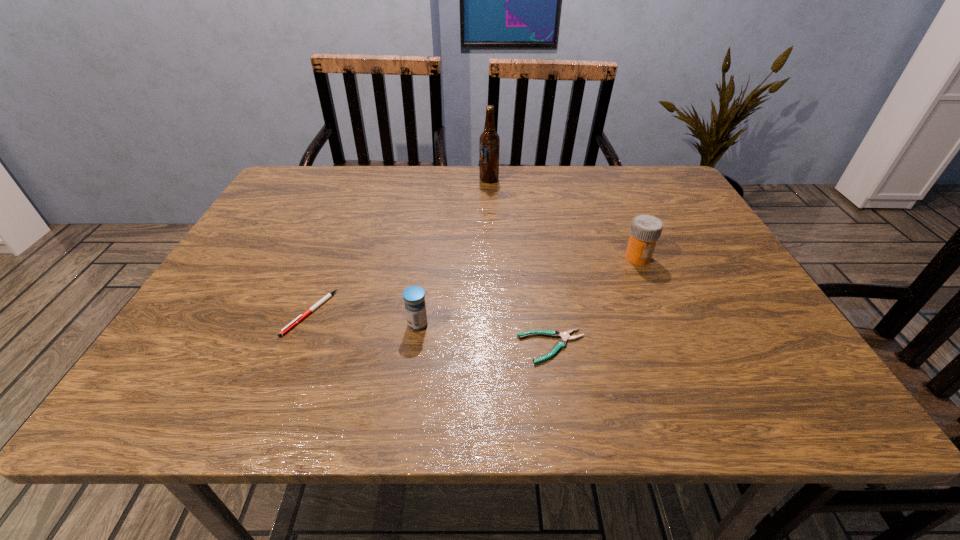
At what (x,y) coordinates should I click in order to perform the action: click on free space between the farthest object and the second shortest object. Please return your answer as a coordinate pair (x, y). The height and width of the screenshot is (540, 960). Looking at the image, I should click on (399, 246).

Where is `free point between the nearer medicine and the rightmost object`? Image resolution: width=960 pixels, height=540 pixels. free point between the nearer medicine and the rightmost object is located at coordinates (528, 291).

You are a GUI agent. You are given a task and a screenshot of the screen. Output one action in this format:
    pyautogui.click(x=<x>, y=<y>)
    Task: Click on the free spot between the leftmost object and the left medicine
    The image size is (960, 540).
    Given the screenshot: What is the action you would take?
    pyautogui.click(x=364, y=319)

This screenshot has width=960, height=540. I want to click on object that stands as the fourth closest to the second shortest object, so click(646, 229).

Locate which object ranks fourth in proximity to the pliers. Please provide its 2D coordinates. Your answer should be formatted as a tuple, i.e. [(x, y)], where the tuple contains the x and y coordinates of a point satisfying the conditions above.

[(489, 139)]

Locate an element on the screen. This screenshot has width=960, height=540. free location that satisfies the following two spatial constraints: 1. on the label of the shortest object; 2. on the right side of the third object from right to left is located at coordinates (494, 347).

The height and width of the screenshot is (540, 960). I want to click on vacant region that satisfies the following two spatial constraints: 1. on the clicker of the pen; 2. on the right side of the pliers, so click(297, 347).

You are a GUI agent. You are given a task and a screenshot of the screen. Output one action in this format:
    pyautogui.click(x=<x>, y=<y>)
    Task: Click on the free space in the image that satisfies the following two spatial constraints: 1. on the label of the beer bottle; 2. on the left side of the second object from right to left
    The width and height of the screenshot is (960, 540).
    Given the screenshot: What is the action you would take?
    pyautogui.click(x=494, y=347)

Identify the location of vacant area that satisfies the following two spatial constraints: 1. on the clicker of the pliers; 2. on the left side of the leftmost object. The image size is (960, 540). (297, 347).